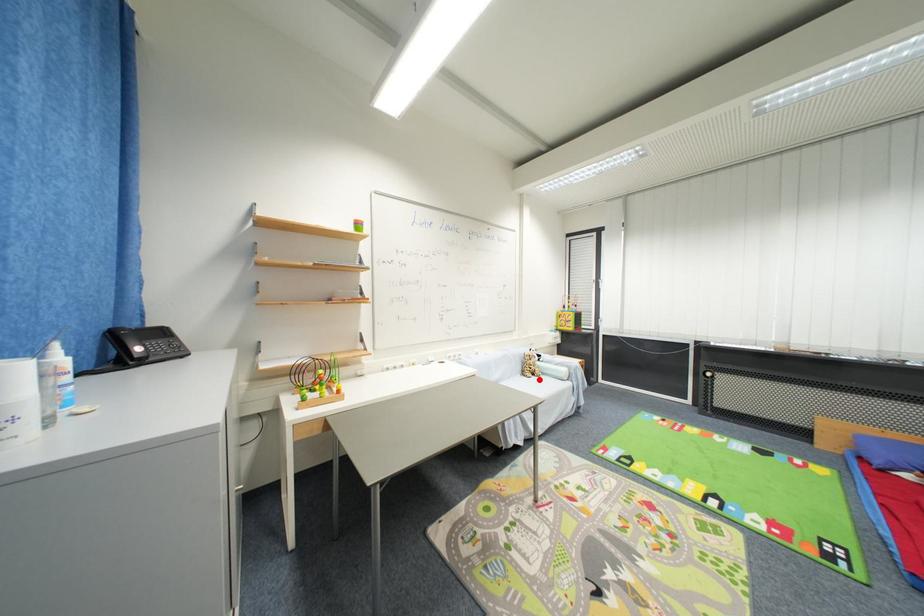
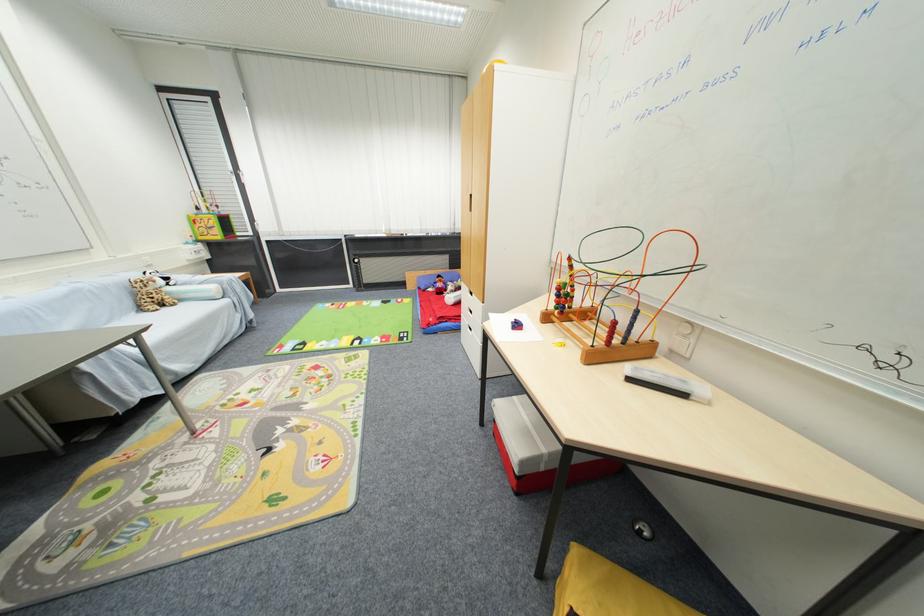
Question: I am providing you with two images of the same scene from different viewpoints. A red point is shown in image1. For the corresponding object point in image2, is it positioned nearer or farther from the camera?

Choices:
 (A) Nearer
 (B) Farther

Answer: (A)